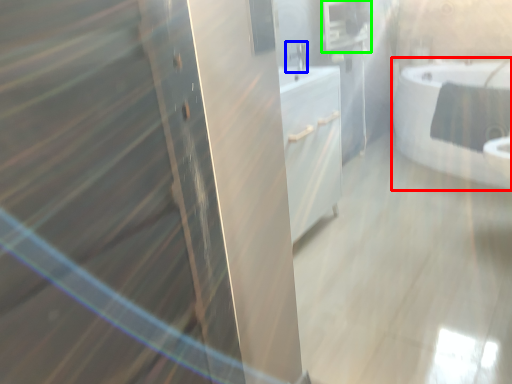
Question: Which object is the farthest from bathtub (highlighted by a red box)? Choose among these: faucet (highlighted by a blue box) or medicine cabinet (highlighted by a green box).

Choices:
 (A) faucet
 (B) medicine cabinet

Answer: (A)